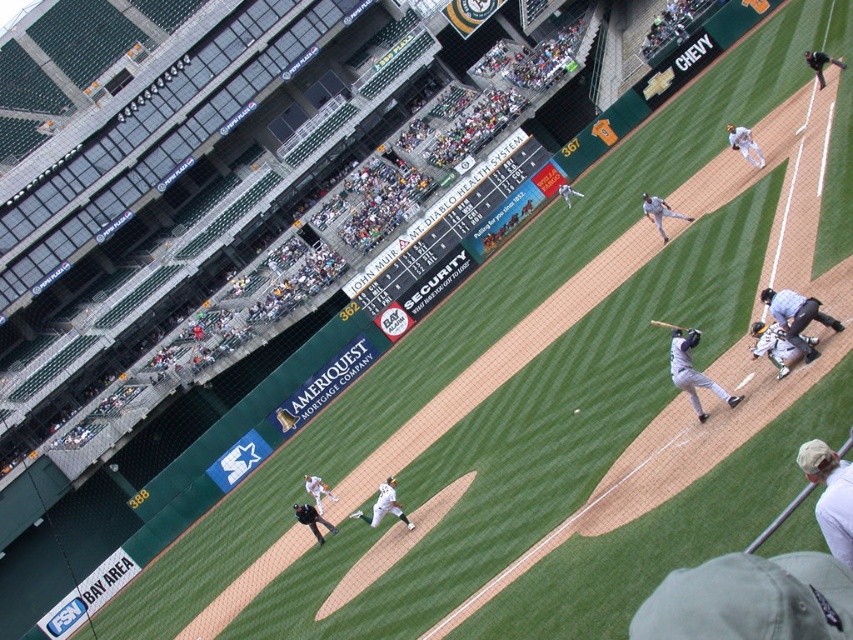
You are a spectator at the baseball game and want to identify the umpire. Which one is larger in size between the gray uniform umpire at right and the gray matte uniform at center?

The gray uniform umpire at right is larger in size than the gray matte uniform at center, so the umpire is the one at the right.

You are a groundskeeper responsible for maintaining the stadium. You need to place a 12 meter long safety net between the white uniform pitcher at center and the dark brown leather glove at lower right. Is this possible?

The distance between the white uniform pitcher at center and the dark brown leather glove at lower right is 10.75 meters. Since the safety net is 12 meters long, it is longer than the distance between them, so placing it between them would be possible as the net can extend beyond both objects.